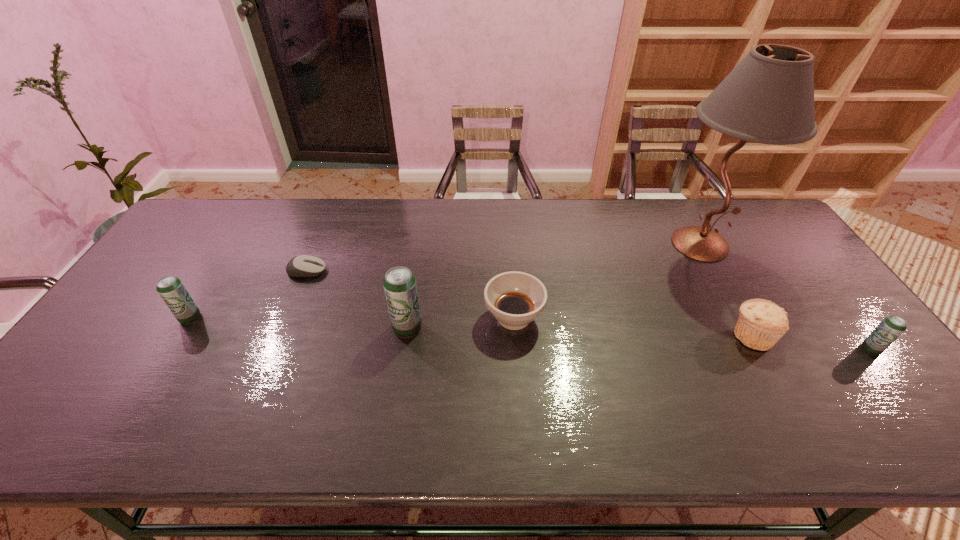
Where is `the second tallest beer can`? Image resolution: width=960 pixels, height=540 pixels. the second tallest beer can is located at coordinates (170, 288).

Where is `the leftmost object`? the leftmost object is located at coordinates (170, 288).

Identify the location of the second beer can from left to right. (399, 283).

Locate an element on the screen. The width and height of the screenshot is (960, 540). the sixth shortest object is located at coordinates (399, 283).

Where is `the rightmost object`? The width and height of the screenshot is (960, 540). the rightmost object is located at coordinates (891, 327).

Identify the location of the nearest beer can. (891, 327).

The image size is (960, 540). Find the location of `table lamp`. table lamp is located at coordinates (768, 98).

Identify the location of the second object from left to right. The height and width of the screenshot is (540, 960). (303, 265).

The width and height of the screenshot is (960, 540). Find the location of `computer equipment`. computer equipment is located at coordinates (303, 265).

Identify the location of the fourth object from right to left. Image resolution: width=960 pixels, height=540 pixels. (515, 299).